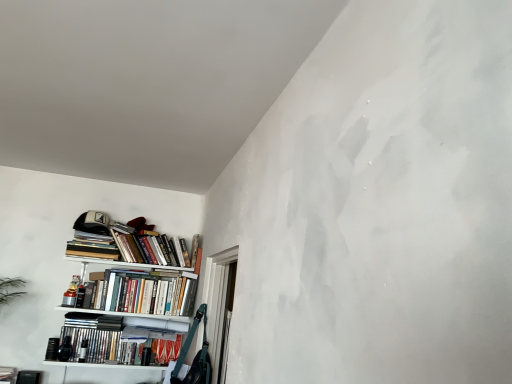
This screenshot has width=512, height=384. Find the location of `hardcover books at upper left, arranged as the 3th book when ordered from the bottom`. hardcover books at upper left, arranged as the 3th book when ordered from the bottom is located at coordinates coord(129,243).

What are the coordinates of `transparent plastic window at lower left` in the screenshot? It's located at (219, 307).

This screenshot has height=384, width=512. I want to click on white matte bookshelf at left, so click(127, 297).

Is hardcover books at center, the 2th book ordered from the bottom, outside of transparent plastic window at lower left?

Yes.

Considering the positions of objects hardcover books at center, which is counted as the third book, starting from the top, and transparent plastic window at lower left in the image provided, who is more to the right, hardcover books at center, which is counted as the third book, starting from the top, or transparent plastic window at lower left?

Answer: From the viewer's perspective, transparent plastic window at lower left appears more on the right side.

Is the surface of hardcover books at center, the 2th book ordered from the bottom, in direct contact with transparent plastic window at lower left?

No, hardcover books at center, the 2th book ordered from the bottom, is not making contact with transparent plastic window at lower left.

Identify the location of the 1st book behind the hardcover books at center, the 2th book ordered from the bottom, starting your count from the anchor. The height and width of the screenshot is (384, 512). (92, 246).

Could you tell me if hardcover books at left, arranged as the 4th book when ordered from the bottom, is facing hardcover books at center, the 2th book ordered from the bottom?

No, hardcover books at left, arranged as the 4th book when ordered from the bottom, is not turned towards hardcover books at center, the 2th book ordered from the bottom.

Considering the sizes of hardcover books at left, the 1th book from the top, and hardcover books at center, which is counted as the third book, starting from the top, in the image, is hardcover books at left, the 1th book from the top, bigger or smaller than hardcover books at center, which is counted as the third book, starting from the top,?

In the image, hardcover books at left, the 1th book from the top, appears to be smaller than hardcover books at center, which is counted as the third book, starting from the top.

From the image's perspective, between hardcover books at left, the 1th book from the top, and hardcover books at center, the 2th book ordered from the bottom, which one is located above?

From the image's view, hardcover books at left, the 1th book from the top, is above.

Would you say white matte bookshelf at left is to the left or to the right of hardcover books at left, the 1th book from the top, in the picture?

white matte bookshelf at left is positioned on hardcover books at left, the 1th book from the top,'s right side.

Does white matte bookshelf at left have a smaller size compared to hardcover books at left, arranged as the 4th book when ordered from the bottom?

No, white matte bookshelf at left is not smaller than hardcover books at left, arranged as the 4th book when ordered from the bottom.

Which point is more distant from viewer, [173,288] or [97,236]?

The point [173,288] is farther from the camera.

Which object is further away from the camera taking this photo, white matte bookshelf at left or hardcover books at left, the 1th book from the top?

hardcover books at left, the 1th book from the top, is further from the camera.

Does white matte bookshelf at left contain transparent plastic window at lower left?

No.

The image size is (512, 384). In order to click on bookcase below the transparent plastic window at lower left (from a real-world perspective) in this screenshot , I will do `click(127, 297)`.

From a real-world perspective, is white matte bookshelf at left over transparent plastic window at lower left?

Actually, white matte bookshelf at left is physically below transparent plastic window at lower left in the real world.

Can you tell me how much white matte bookshelf at left and transparent plastic window at lower left differ in facing direction?

The facing directions of white matte bookshelf at left and transparent plastic window at lower left are 89.2 degrees apart.

From the image's perspective, which one is positioned higher, transparent plastic window at lower left or hardcover books at left, the 1th book from the top?

hardcover books at left, the 1th book from the top, appears higher in the image.

Find the location of a particular element. Image resolution: width=512 pixels, height=384 pixels. book that is the 2nd one above the transparent plastic window at lower left (from a real-world perspective) is located at coordinates (92, 246).

Is point (215, 383) farther from camera compared to point (80, 242)?

No.

From the image's perspective, is hardcover books at center, the 2th book ordered from the bottom, on top of hardcover books at left, the 1th book from the top?

Incorrect, from the image's perspective, hardcover books at center, the 2th book ordered from the bottom, is lower than hardcover books at left, the 1th book from the top.

Is hardcover books at center, the 2th book ordered from the bottom, to the left of hardcover books at left, the 1th book from the top, from the viewer's perspective?

Incorrect, hardcover books at center, the 2th book ordered from the bottom, is not on the left side of hardcover books at left, the 1th book from the top.

Would you say hardcover books at left, the 1th book from the top, is part of hardcover books at center, the 2th book ordered from the bottom,'s contents?

No, hardcover books at left, the 1th book from the top, is located outside of hardcover books at center, the 2th book ordered from the bottom.

Which is nearer, (x=187, y=299) or (x=98, y=257)?

The point (x=98, y=257) is in front.

Consider the image. Does transparent plastic window at lower left have a lesser width compared to white matte bookshelf at left?

Yes, transparent plastic window at lower left is thinner than white matte bookshelf at left.

Is point (225, 338) farther from camera compared to point (184, 278)?

No, it is not.

Is transparent plastic window at lower left bigger than white matte bookshelf at left?

No.

Is transparent plastic window at lower left turned away from white matte bookshelf at left?

transparent plastic window at lower left is not turned away from white matte bookshelf at left.

From the image's perspective, which book is the 1st one above the transparent plastic window at lower left? Please provide its 2D coordinates.

[(141, 294)]

This screenshot has height=384, width=512. In order to click on book that is the 1st one below the hardcover books at left, the 1th book from the top (from a real-world perspective) in this screenshot , I will do `click(141, 294)`.

Estimate the real-world distances between objects in this image. Which object is closer to white matte bookshelf at left, transparent plastic window at lower left or hardcover books at center, the 2th book ordered from the bottom?

Based on the image, hardcover books at center, the 2th book ordered from the bottom, appears to be nearer to white matte bookshelf at left.

Estimate the real-world distances between objects in this image. Which object is closer to white matte bookshelf at left, transparent plastic window at lower left or hardcover books at left, arranged as the 4th book when ordered from the bottom?

Based on the image, hardcover books at left, arranged as the 4th book when ordered from the bottom, appears to be nearer to white matte bookshelf at left.

Which object lies further to the anchor point white matte bookshelf at left, hardcover books at left, arranged as the 4th book when ordered from the bottom, or matte black bookshelf at lower left, which is the first book from bottom to top?

The object further to white matte bookshelf at left is hardcover books at left, arranged as the 4th book when ordered from the bottom.

Which object lies nearer to the anchor point hardcover books at center, the 2th book ordered from the bottom, white matte bookshelf at left or hardcover books at upper left, arranged as the 3th book when ordered from the bottom?

Based on the image, white matte bookshelf at left appears to be nearer to hardcover books at center, the 2th book ordered from the bottom.

From the image, which object appears to be nearer to hardcover books at upper left, arranged as the 3th book when ordered from the bottom, matte black bookshelf at lower left, the 4th book positioned from the top, or hardcover books at left, arranged as the 4th book when ordered from the bottom?

hardcover books at left, arranged as the 4th book when ordered from the bottom, is positioned closer to the anchor hardcover books at upper left, arranged as the 3th book when ordered from the bottom.

Consider the image. Considering their positions, is hardcover books at center, which is counted as the third book, starting from the top, positioned further to hardcover books at left, arranged as the 4th book when ordered from the bottom, than transparent plastic window at lower left?

transparent plastic window at lower left is further to hardcover books at left, arranged as the 4th book when ordered from the bottom.

From the picture: From the image, which object appears to be nearer to hardcover books at left, arranged as the 4th book when ordered from the bottom, hardcover books at center, which is counted as the third book, starting from the top, or white matte bookshelf at left?

hardcover books at center, which is counted as the third book, starting from the top, is closer to hardcover books at left, arranged as the 4th book when ordered from the bottom.

In the scene shown: Based on their spatial positions, is hardcover books at upper left, the second book positioned from the top, or hardcover books at left, the 1th book from the top, further from hardcover books at center, the 2th book ordered from the bottom?

hardcover books at left, the 1th book from the top, lies further to hardcover books at center, the 2th book ordered from the bottom, than the other object.

Where is `book between hardcover books at upper left, the second book positioned from the top, and matte black bookshelf at lower left, which is the first book from bottom to top, from top to bottom`? book between hardcover books at upper left, the second book positioned from the top, and matte black bookshelf at lower left, which is the first book from bottom to top, from top to bottom is located at coordinates (141, 294).

I want to click on bookcase between hardcover books at upper left, arranged as the 3th book when ordered from the bottom, and matte black bookshelf at lower left, the 4th book positioned from the top, from top to bottom, so click(x=127, y=297).

This screenshot has width=512, height=384. In order to click on bookcase positioned between transparent plastic window at lower left and matte black bookshelf at lower left, which is the first book from bottom to top, from near to far in this screenshot , I will do `click(127, 297)`.

The width and height of the screenshot is (512, 384). Find the location of `book between hardcover books at upper left, arranged as the 3th book when ordered from the bottom, and white matte bookshelf at left from top to bottom`. book between hardcover books at upper left, arranged as the 3th book when ordered from the bottom, and white matte bookshelf at left from top to bottom is located at coordinates (141, 294).